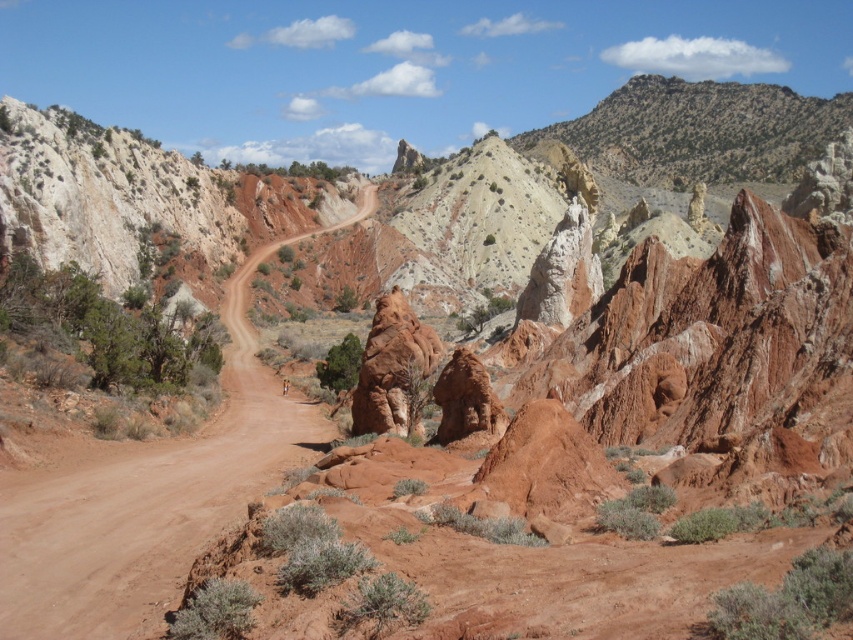
You are driving a truck that needs to navigate around the dusty dirt road at center and the rustic sandstone rock at center. Which object is positioned lower in the scene?

The dusty dirt road at center is positioned below rustic sandstone rock at center, so it is lower in the scene.

You are standing at the starting point of the desert road and want to reach a hidden oasis. There are two landmarks marked as point coordinates in the scene. Which point is closer to you, point [233,289] or point [370,372]?

Point [233,289] is closer to you because it is further to the viewer than point [370,372], meaning it is nearer in the scene.